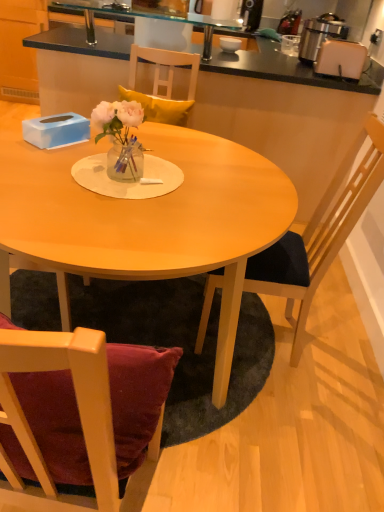
Find the location of a particular element. The image size is (384, 512). free point below clear glass vase at center (from a real-world perspective) is located at coordinates (127, 176).